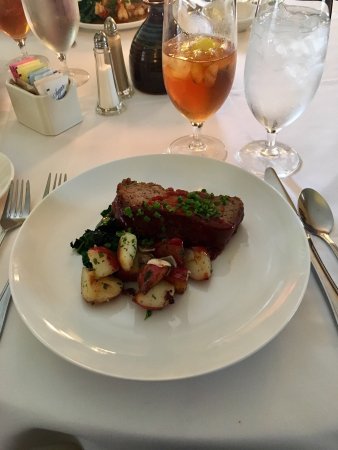
Locate an element on the screen. The image size is (338, 450). dish is located at coordinates (39, 124).